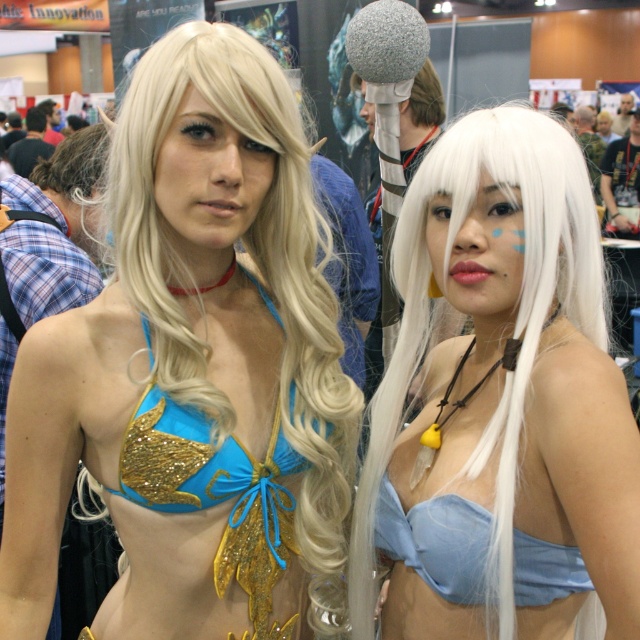
You are a photographer at a cosplay event. You need to capture a photo where both the matte blue bikini top at center and the glittery blue bikini top at center are visible. Which one should you focus on to ensure the other is in the background?

The matte blue bikini top at center is above the glittery blue bikini top at center, so focusing on the matte blue bikini top at center will keep the glittery blue bikini top at center in the background.